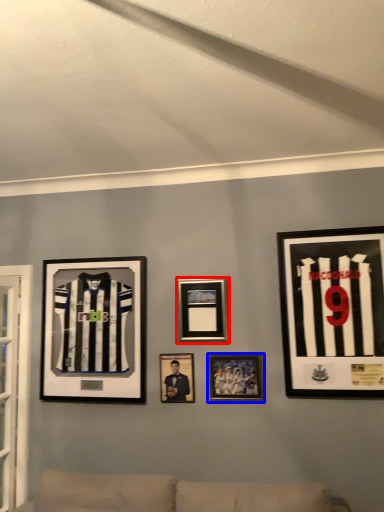
Question: Among these objects, which one is nearest to the camera, picture frame (highlighted by a red box) or picture frame (highlighted by a blue box)?

Choices:
 (A) picture frame
 (B) picture frame

Answer: (B)